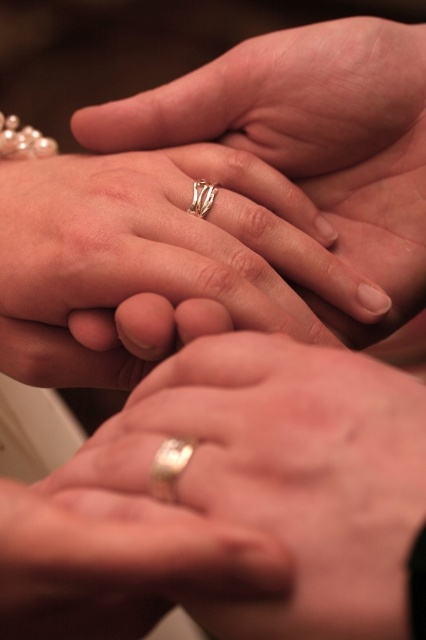
Question: Can you confirm if polished silver ring at center is smaller than gold shiny ring at lower center?

Choices:
 (A) no
 (B) yes

Answer: (A)

Question: Can you confirm if polished silver ring at center is smaller than gold shiny ring at lower center?

Choices:
 (A) no
 (B) yes

Answer: (A)

Question: Which object is positioned closest to the silver metallic ring at center?

Choices:
 (A) polished silver ring at center
 (B) gold metallic ring at center

Answer: (A)

Question: Which of these objects is positioned farthest from the polished silver ring at center?

Choices:
 (A) silver metallic ring at center
 (B) gold metallic ring at center

Answer: (B)

Question: From the image, what is the correct spatial relationship of gold metallic ring at center in relation to polished silver ring at center?

Choices:
 (A) below
 (B) above

Answer: (A)

Question: Which of the following is the closest to the observer?

Choices:
 (A) silver metallic ring at center
 (B) polished silver ring at center

Answer: (B)